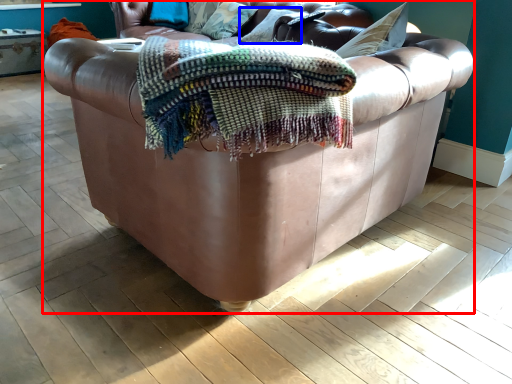
Question: Among these objects, which one is farthest to the camera, studio couch (highlighted by a red box) or pillow (highlighted by a blue box)?

Choices:
 (A) studio couch
 (B) pillow

Answer: (B)